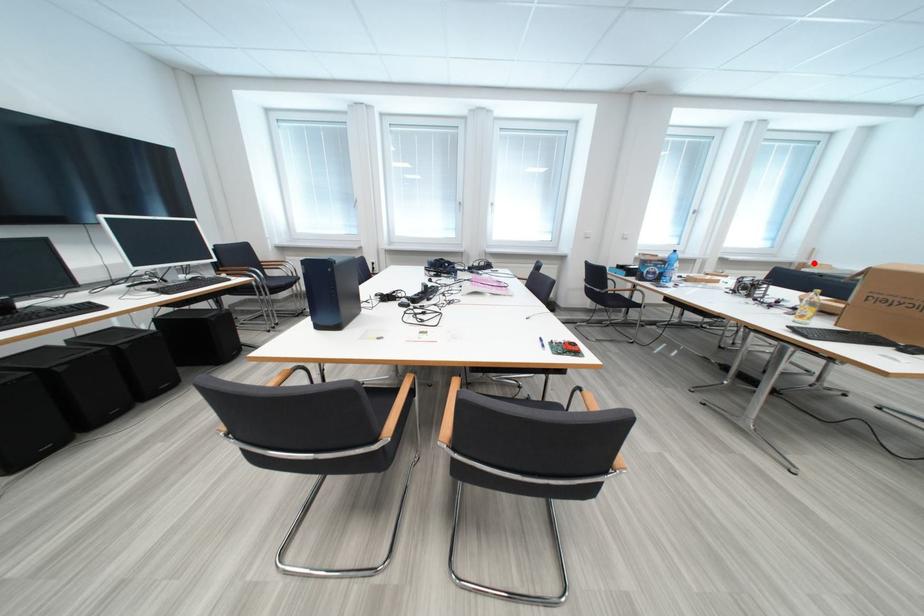
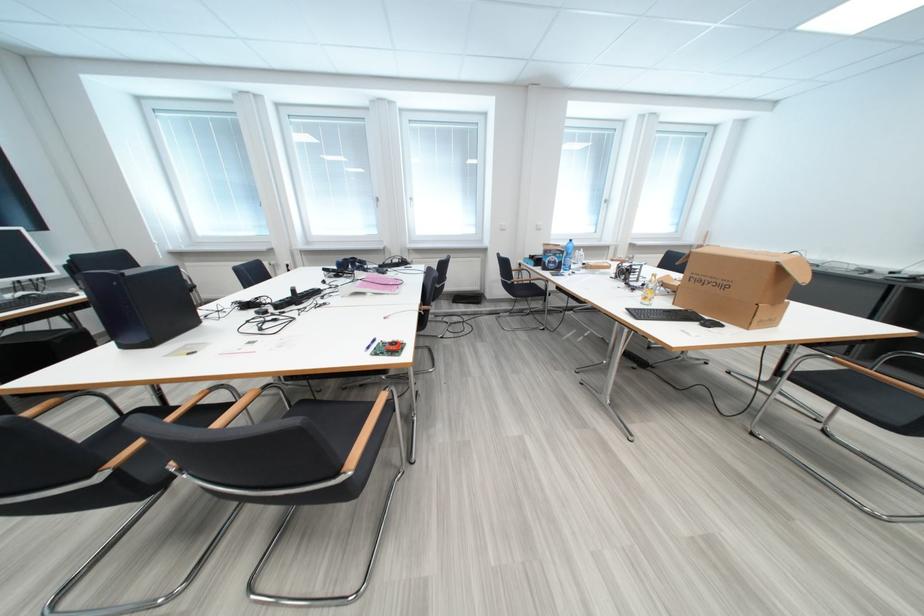
Question: I am providing you with two images of the same scene from different viewpoints. A red point is shown in image1. For the corresponding object point in image2, is it positioned nearer or farther from the camera?

Choices:
 (A) Nearer
 (B) Farther

Answer: (A)